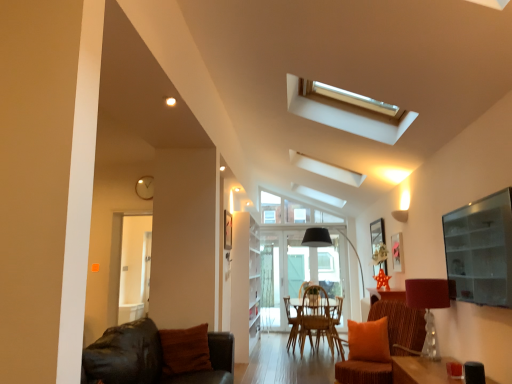
Question: Is transparent glass door at left, arranged as the second glass door when viewed from the back, inside or outside of transparent glass door at center, placed as the 2th glass door when sorted from left to right?

Choices:
 (A) inside
 (B) outside

Answer: (B)

Question: Is transparent glass door at left, arranged as the first glass door when viewed from the front, bigger or smaller than transparent glass door at center, the first glass door in the right-to-left sequence?

Choices:
 (A) small
 (B) big

Answer: (B)

Question: Which object is the farthest from the transparent glass door at center, which is the first glass door from back to front?

Choices:
 (A) brown woven armchair at center
 (B) translucent glass lampshade at right
 (C) transparent glass door at left, the 2th glass door in the right-to-left sequence
 (D) orange fabric chair at lower right, arranged as the 2th chair when viewed from the back
 (E) rustic wood chair at center, which appears as the 2th chair when viewed from the front

Answer: (B)

Question: Considering the real-world distances, which object is farthest from the transparent glass door at center, placed as the 2th glass door when sorted from left to right?

Choices:
 (A) brown fuzzy pillow at lower left
 (B) rustic wood chair at center, the first chair in the back-to-front sequence
 (C) transparent glass door at left, arranged as the first glass door when viewed from the front
 (D) brown woven armchair at center
 (E) translucent glass lampshade at right

Answer: (E)